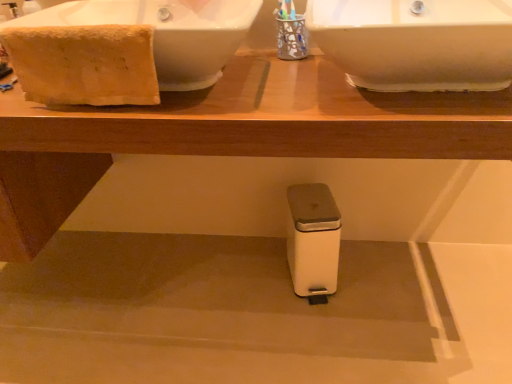
Where is `vacant space underneath white plastic table at center (from a real-world perspective)`? vacant space underneath white plastic table at center (from a real-world perspective) is located at coordinates (170, 294).